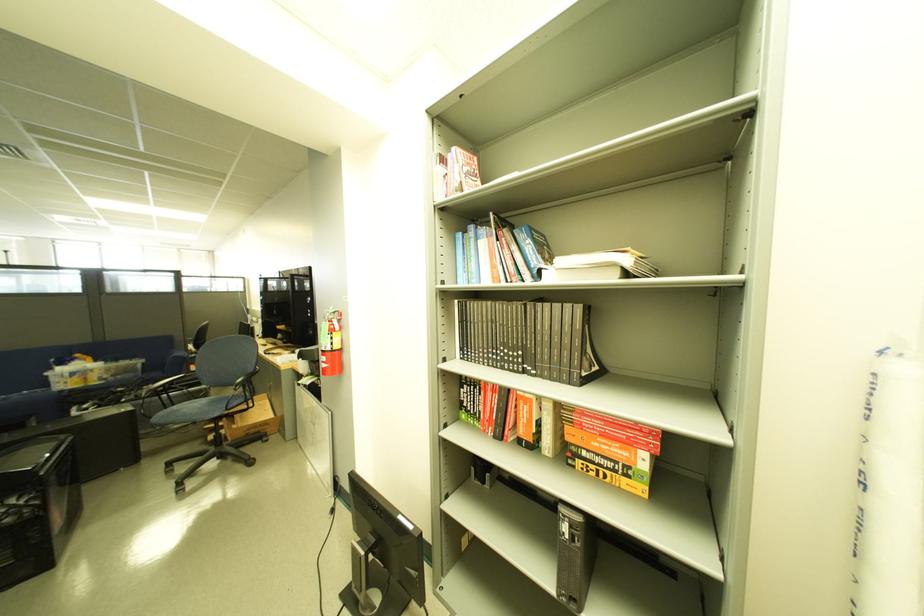
The width and height of the screenshot is (924, 616). Find the location of `extinguisher safety pin`. extinguisher safety pin is located at coordinates (331, 344).